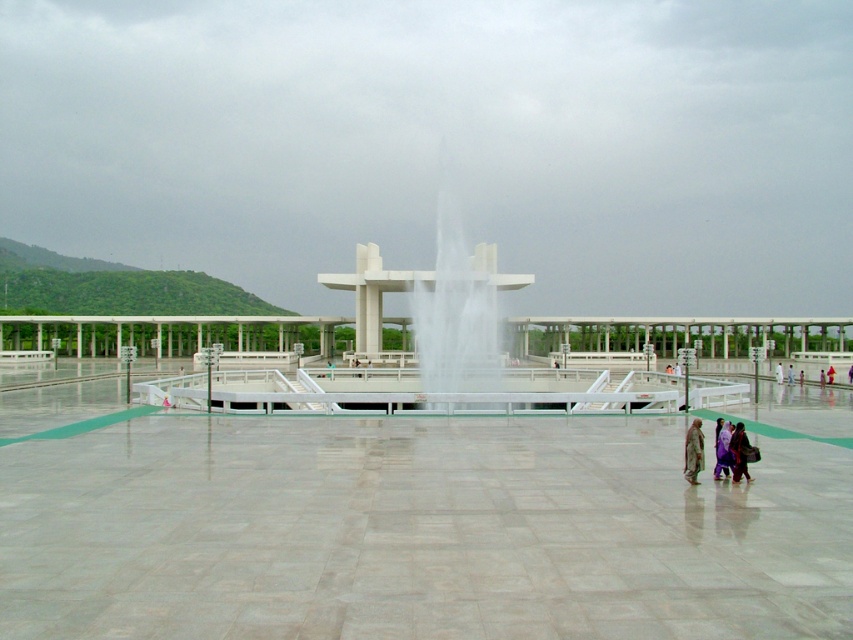
This screenshot has height=640, width=853. Describe the element at coordinates (822, 378) in the screenshot. I see `light pink fabric dress at center` at that location.

Does light pink fabric dress at center appear on the right side of light purple fabric dress at lower right?

Yes, light pink fabric dress at center is to the right of light purple fabric dress at lower right.

Does point (821, 372) come farther from viewer compared to point (799, 385)?

Yes, point (821, 372) is behind point (799, 385).

Find the location of `light pink fabric dress at center`. light pink fabric dress at center is located at coordinates (822, 378).

Find the location of a particular element. The image size is (853, 640). white cloth at center is located at coordinates (778, 372).

Does white cloth at center have a smaller size compared to light pink fabric dress at center?

Actually, white cloth at center might be larger than light pink fabric dress at center.

In order to click on white cloth at center in this screenshot , I will do click(x=778, y=372).

Is light brown fabric person at lower right positioned behind light pink fabric dress at center?

No, light brown fabric person at lower right is closer to the viewer.

Can you confirm if light brown fabric person at lower right is thinner than light pink fabric dress at center?

Yes, light brown fabric person at lower right is thinner than light pink fabric dress at center.

Image resolution: width=853 pixels, height=640 pixels. Describe the element at coordinates (693, 451) in the screenshot. I see `light brown fabric person at lower right` at that location.

Locate an element on the screen. light brown fabric person at lower right is located at coordinates (693, 451).